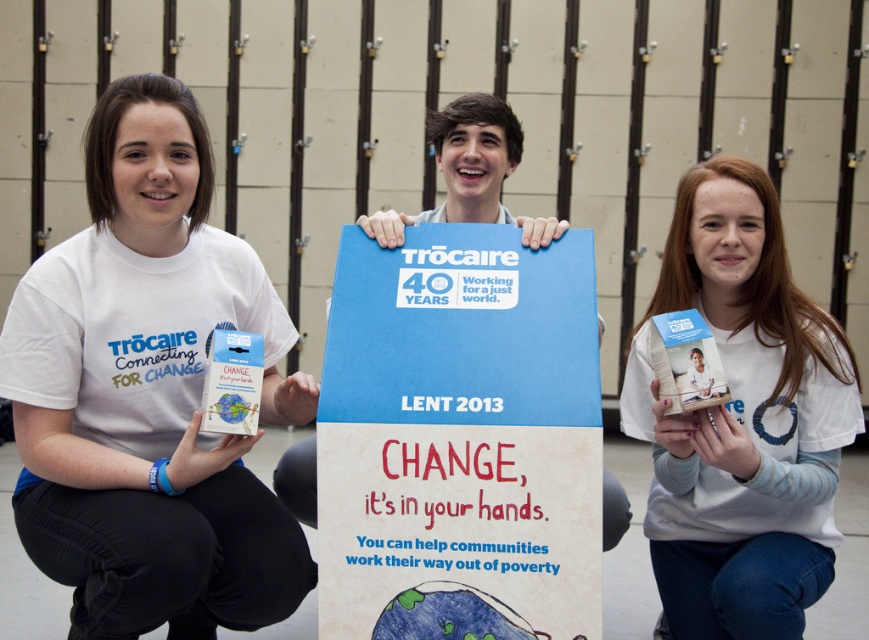
Is white matte t-shirt at left to the left of white matte book at center from the viewer's perspective?

Yes, white matte t-shirt at left is to the left of white matte book at center.

Can you confirm if white matte t-shirt at left is wider than white matte book at center?

Yes.

Find the location of a particular element. white matte t-shirt at left is located at coordinates (144, 392).

At what (x,y) coordinates should I click in order to perform the action: click on white matte t-shirt at left. Please return your answer as a coordinate pair (x, y). The width and height of the screenshot is (869, 640). Looking at the image, I should click on (144, 392).

Describe the element at coordinates (741, 420) in the screenshot. Image resolution: width=869 pixels, height=640 pixels. I see `white matte book at center` at that location.

Does white matte book at center appear under blue cardboard poster at center?

Indeed, white matte book at center is positioned under blue cardboard poster at center.

At what (x,y) coordinates should I click in order to perform the action: click on white matte book at center. Please return your answer as a coordinate pair (x, y). Looking at the image, I should click on (741, 420).

Between white matte t-shirt at left and blue cardboard poster at center, which one has less height?

Standing shorter between the two is blue cardboard poster at center.

Describe the element at coordinates (144, 392) in the screenshot. This screenshot has height=640, width=869. I see `white matte t-shirt at left` at that location.

Locate an element on the screen. The width and height of the screenshot is (869, 640). white matte t-shirt at left is located at coordinates (144, 392).